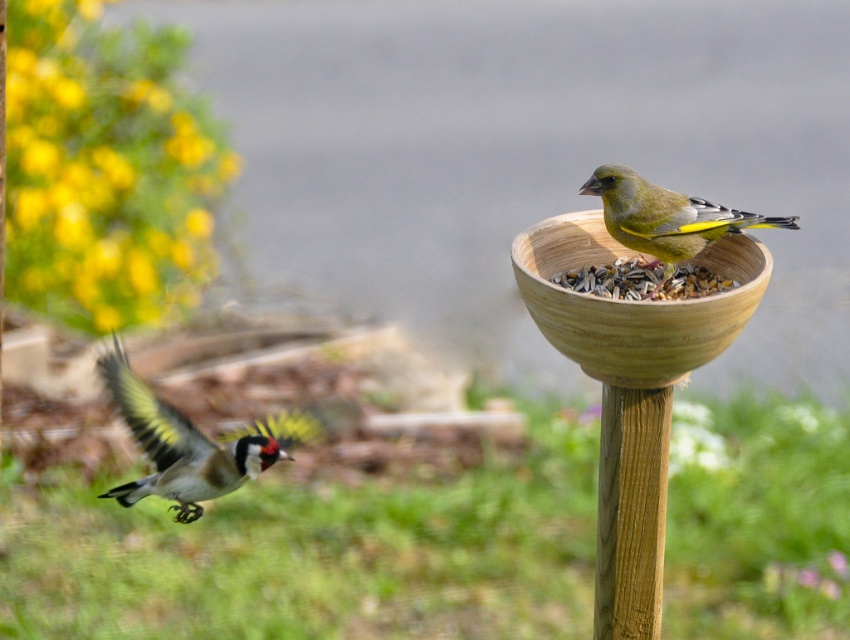
You are a birdwatcher observing the scene. You notice the speckled feathered bird at left and the brown wooden bowl at upper right. Which object is located below the other?

The speckled feathered bird at left is positioned under the brown wooden bowl at upper right.

You are a birdwatcher observing the scene. You notice the speckled feathered bird at left and the brown wooden bowl at upper right. Which object has a greater width?

The speckled feathered bird at left has a greater width than the brown wooden bowl at upper right according to the description.